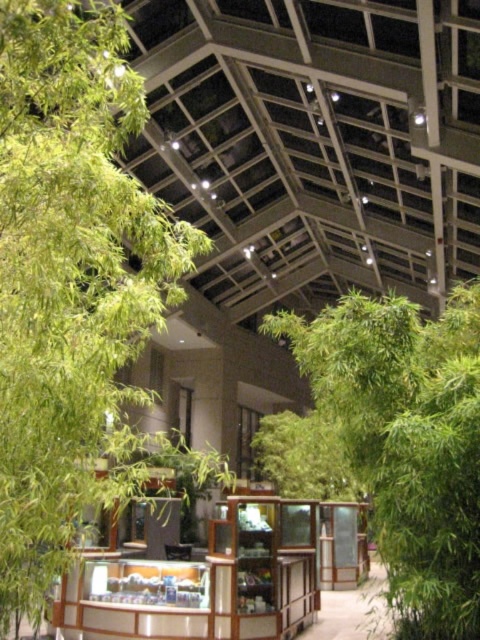
Based on the photo, you are a customer in the atrium and want to see both the green leafy tree at left and the wooden display case at center. Which object should you look at first to see both without moving your position?

The green leafy tree at left is positioned on the left side of the wooden display case at center, so you should look at the wooden display case at center first. By focusing on the center display case, you can naturally take in the tree to its left without needing to shift your position.

Looking at this image, you are a visitor in the atrium and want to take a photo of the green leafy bamboo at right and the wooden display case at center. Which object should you focus on first if you want to capture both in one frame without moving the camera?

The green leafy bamboo at right is larger in size than the wooden display case at center, so you should focus on the green leafy bamboo at right first to ensure it fits properly in the frame.

You are a visitor in the atrium and want to take a photo of the green leafy tree at left and the wooden display case at center. Which object will appear smaller in your photo?

The green leafy tree at left will appear smaller in the photo because it is shorter than the wooden display case at center.